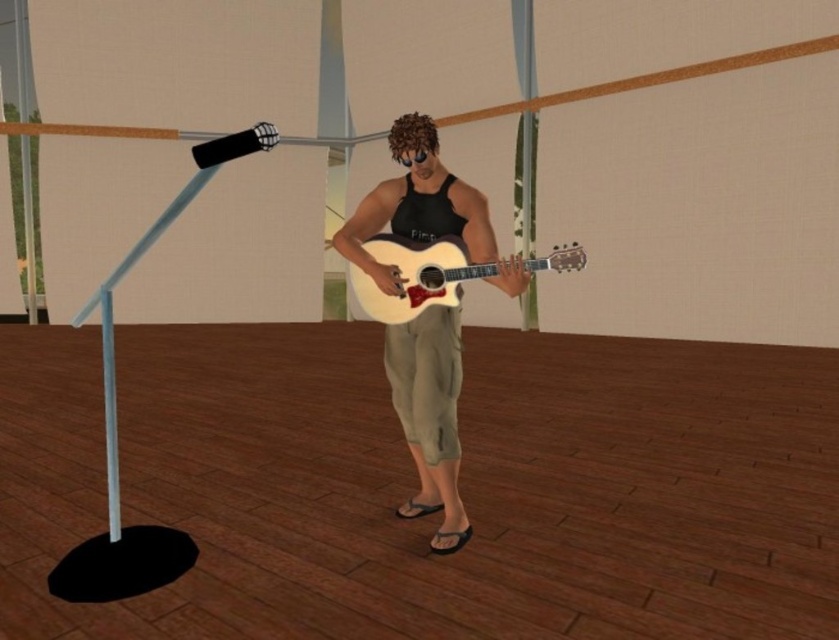
Question: Which point is closer to the camera taking this photo?

Choices:
 (A) (472, 188)
 (B) (404, 305)

Answer: (B)

Question: Is matte black tank top at center wider than light wood acoustic guitar at center?

Choices:
 (A) yes
 (B) no

Answer: (B)

Question: Can you confirm if matte black tank top at center is thinner than light wood acoustic guitar at center?

Choices:
 (A) no
 (B) yes

Answer: (B)

Question: Which point is farther to the camera?

Choices:
 (A) light wood acoustic guitar at center
 (B) matte black tank top at center

Answer: (A)

Question: Is matte black tank top at center positioned before light wood acoustic guitar at center?

Choices:
 (A) yes
 (B) no

Answer: (A)